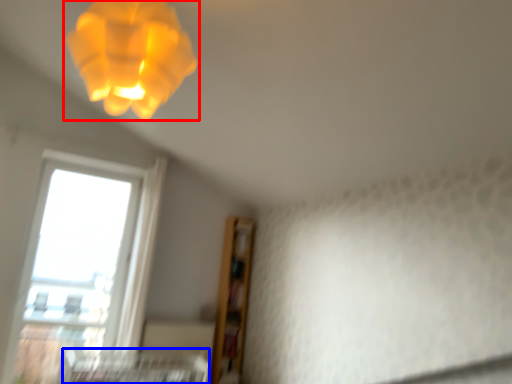
Question: Among these objects, which one is nearest to the camera, lamp (highlighted by a red box) or bed frame (highlighted by a blue box)?

Choices:
 (A) lamp
 (B) bed frame

Answer: (A)